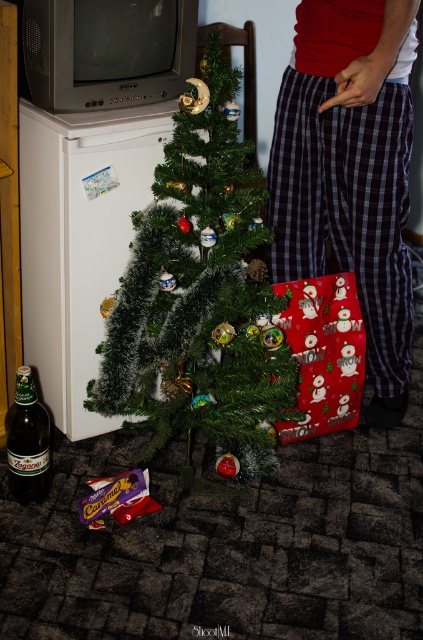
You are a delivery person who needs to place a small box between the plaid cotton pants at center and the brown glass bottle at lower left. Can you fit it vertically between them?

The plaid cotton pants at center is taller than the brown glass bottle at lower left, so there is sufficient vertical space to fit a small box between them.

You are a decorator preparing to place a new ornament on the green matte christmas tree at center. You need to ensure that the plaid cotton pants at center won

The green matte christmas tree at center is taller than the plaid cotton pants at center, so the ornament can be placed on the tree without obstructing the view of the pants.

You are standing in the room and want to place a new decoration on the green matte christmas tree at center. According to the coordinates provided, where exactly should you place the decoration?

A: The green matte christmas tree at center is located at point coordinates (200, 298), so you should place the decoration there.